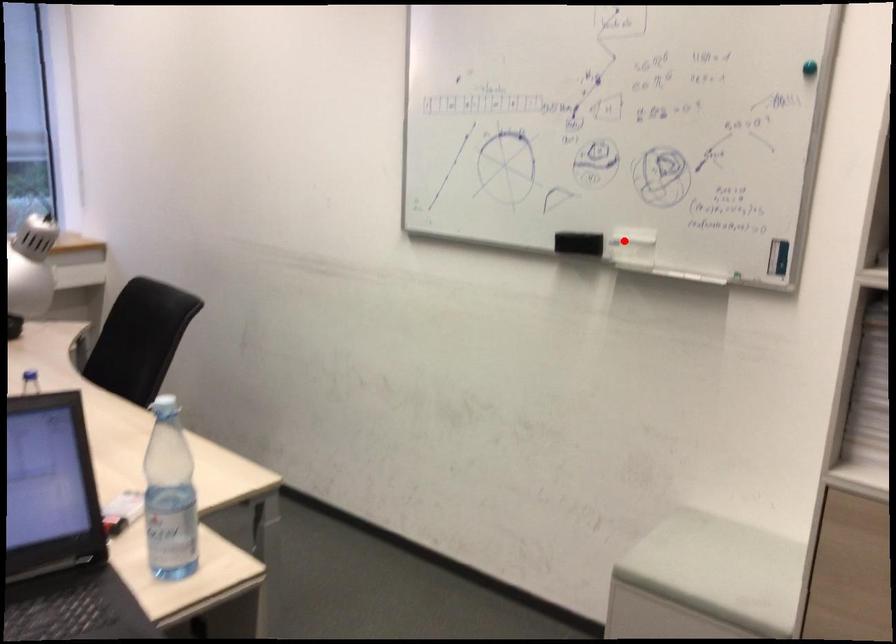
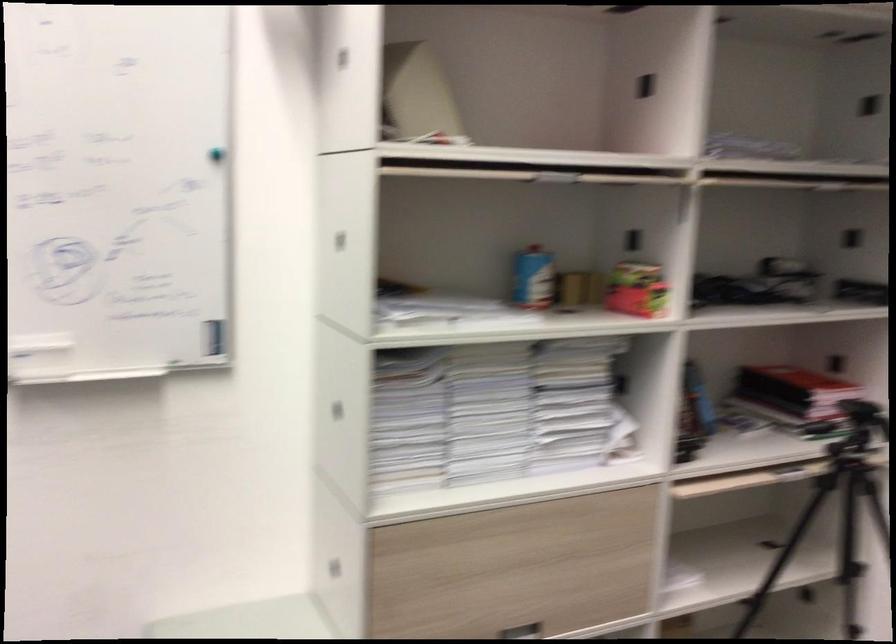
Where in the second image is the point corresponding to the highlighted location from the first image?

(33, 350)